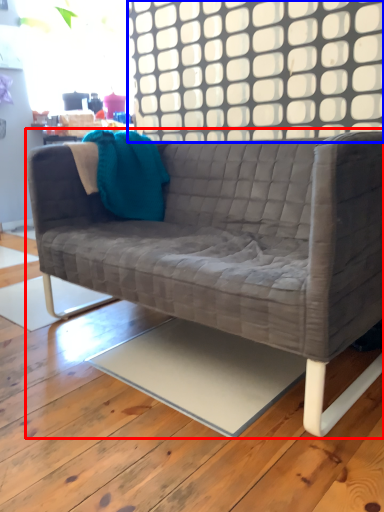
Question: Which of the following is the closest to the observer, studio couch (highlighted by a red box) or window (highlighted by a blue box)?

Choices:
 (A) studio couch
 (B) window

Answer: (A)